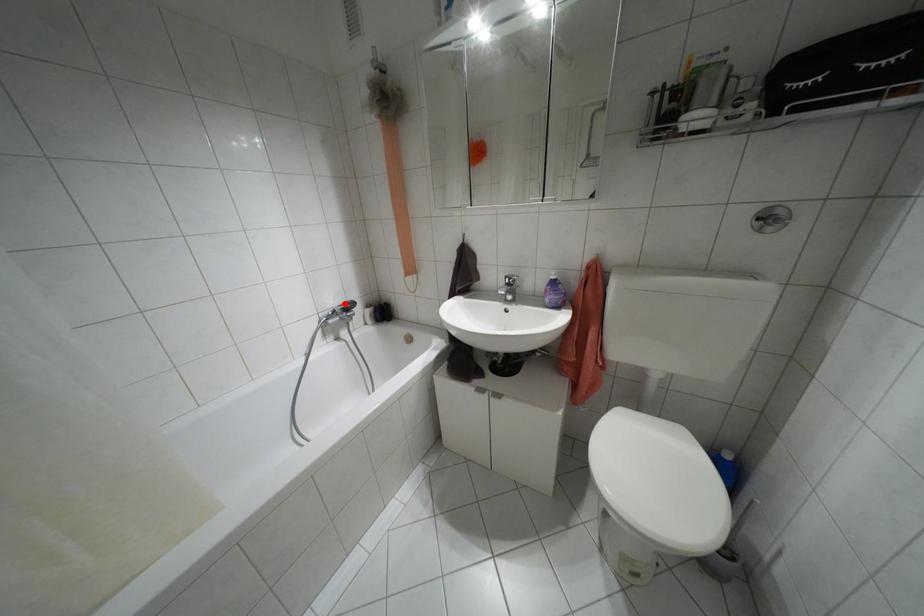
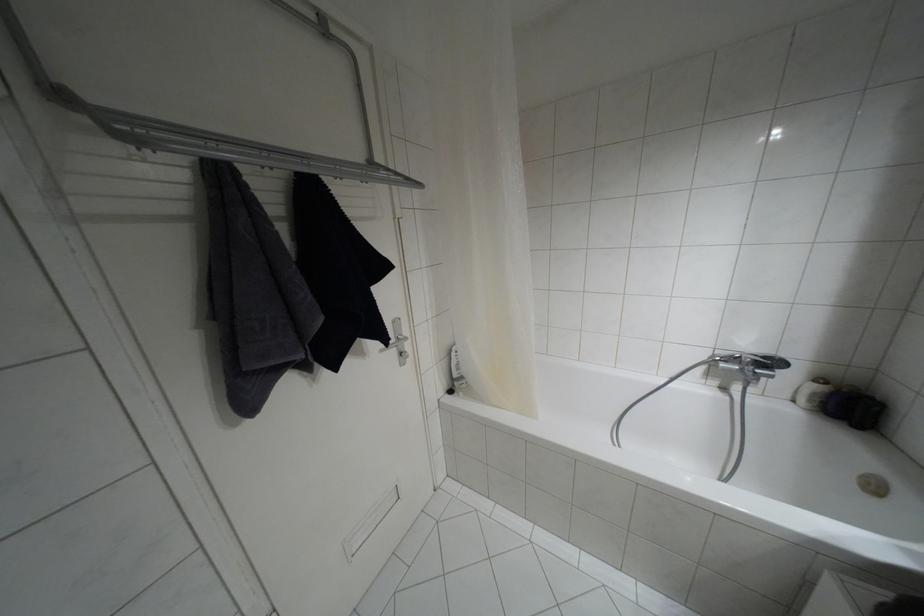
In the second image, find the point that corresponds to the highlighted location in the first image.

(763, 357)